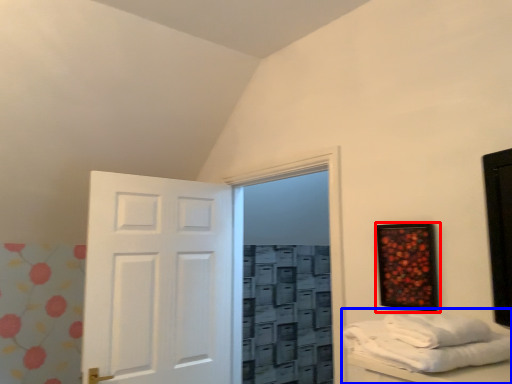
Question: Which object appears closest to the camera in this image, picture frame (highlighted by a red box) or furniture (highlighted by a blue box)?

Choices:
 (A) picture frame
 (B) furniture

Answer: (B)